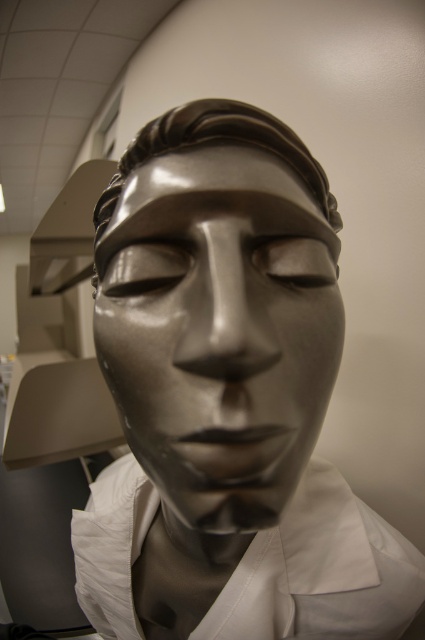
Question: Which point is closer to the camera taking this photo?

Choices:
 (A) (323, 209)
 (B) (124, 314)

Answer: (B)

Question: Which of the following is the farthest from the observer?

Choices:
 (A) (323, 209)
 (B) (251, 554)

Answer: (B)

Question: Can you confirm if shiny bronze mask at center is positioned to the left of white matte dress shirt at center?

Choices:
 (A) no
 (B) yes

Answer: (A)

Question: Is white matte dress shirt at center to the right of shiny bronze forehead at center from the viewer's perspective?

Choices:
 (A) no
 (B) yes

Answer: (A)

Question: Does white matte dress shirt at center appear on the right side of shiny bronze forehead at center?

Choices:
 (A) yes
 (B) no

Answer: (B)

Question: Which object is positioned farthest from the shiny bronze forehead at center?

Choices:
 (A) white matte dress shirt at center
 (B) shiny bronze mask at center

Answer: (A)